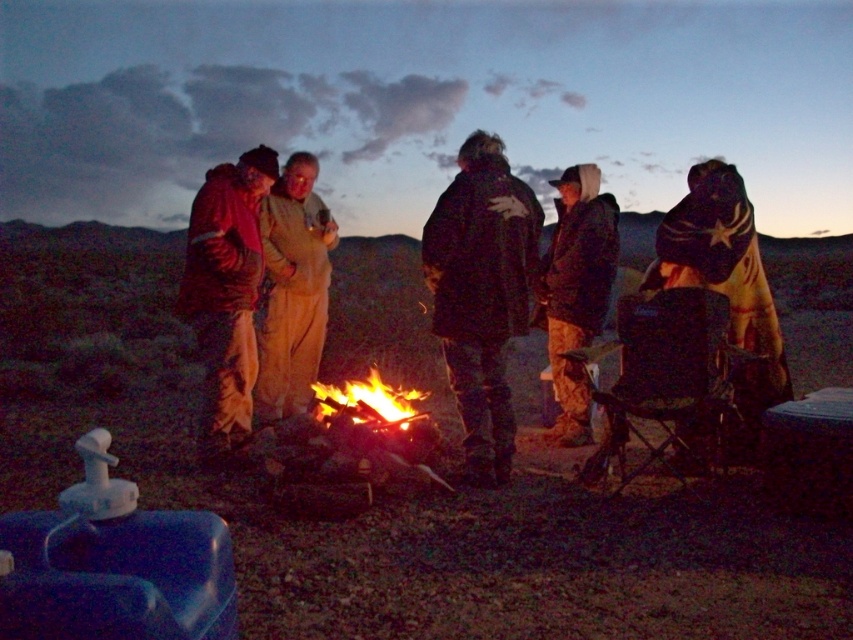
Measure the distance from red fleece jacket at center to flaming wood at center.

red fleece jacket at center and flaming wood at center are 32.90 inches apart.

Between red fleece jacket at center and flaming wood at center, which one is positioned higher?

red fleece jacket at center is above.

Where is `red fleece jacket at center`? This screenshot has width=853, height=640. red fleece jacket at center is located at coordinates (225, 292).

Can you confirm if red fleece jacket at center is positioned to the left of camouflage pants at center?

Indeed, red fleece jacket at center is positioned on the left side of camouflage pants at center.

Describe the element at coordinates (225, 292) in the screenshot. I see `red fleece jacket at center` at that location.

Find the location of a particular element. Image resolution: width=853 pixels, height=640 pixels. red fleece jacket at center is located at coordinates (225, 292).

Between red fleece jacket at center and light brown fabric jacket at center, which one is positioned higher?

Positioned higher is light brown fabric jacket at center.

Who is positioned more to the left, red fleece jacket at center or light brown fabric jacket at center?

red fleece jacket at center is more to the left.

The height and width of the screenshot is (640, 853). Find the location of `red fleece jacket at center`. red fleece jacket at center is located at coordinates (225, 292).

The height and width of the screenshot is (640, 853). What are the coordinates of `red fleece jacket at center` in the screenshot? It's located at (225, 292).